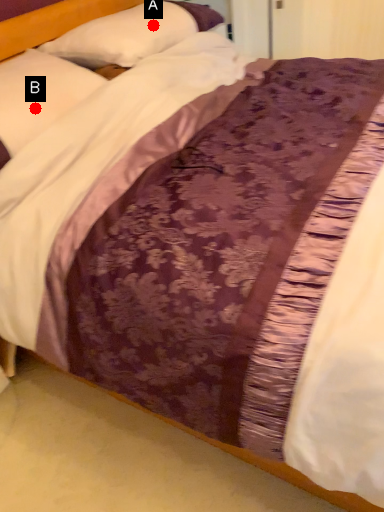
Question: Two points are circled on the image, labeled by A and B beside each circle. Which point is farther from the camera taking this photo?

Choices:
 (A) A is further
 (B) B is further

Answer: (A)